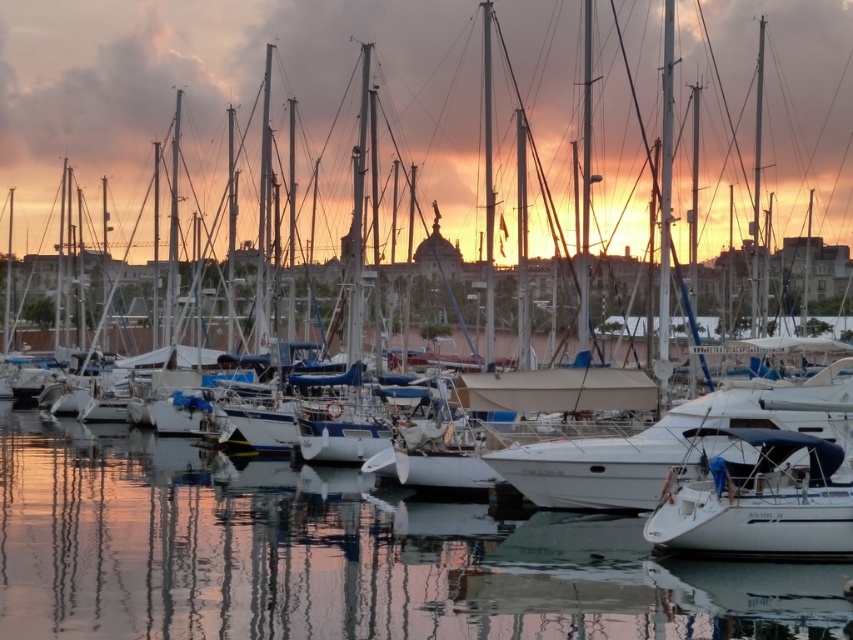
Consider the image. Can you confirm if clear water at center is positioned above white matte sailboat at lower right?

No, clear water at center is not above white matte sailboat at lower right.

Between clear water at center and white matte sailboat at lower right, which one has more height?

Standing taller between the two is clear water at center.

Which is in front, point (65, 620) or point (669, 536)?

Positioned in front is point (65, 620).

Locate an element on the screen. This screenshot has width=853, height=640. clear water at center is located at coordinates (339, 556).